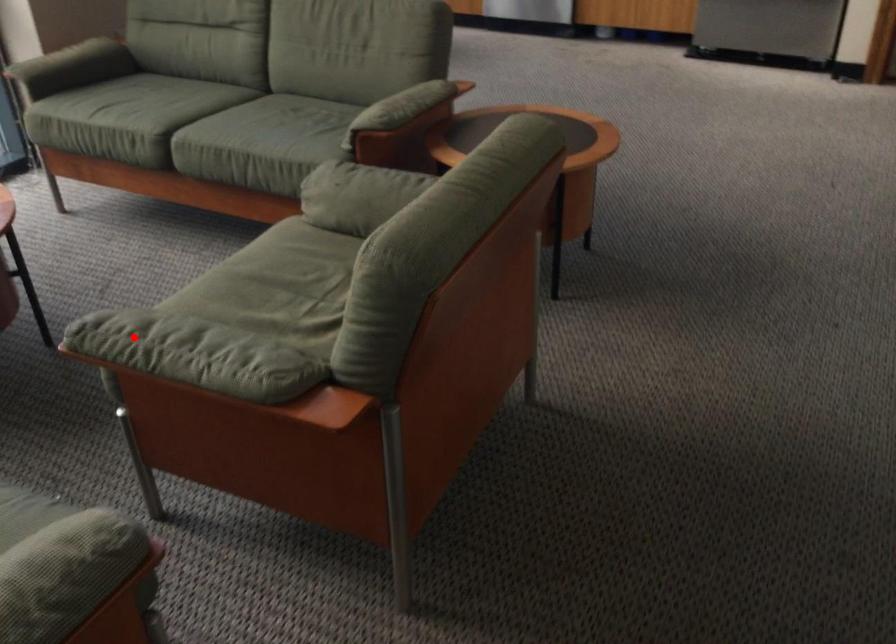
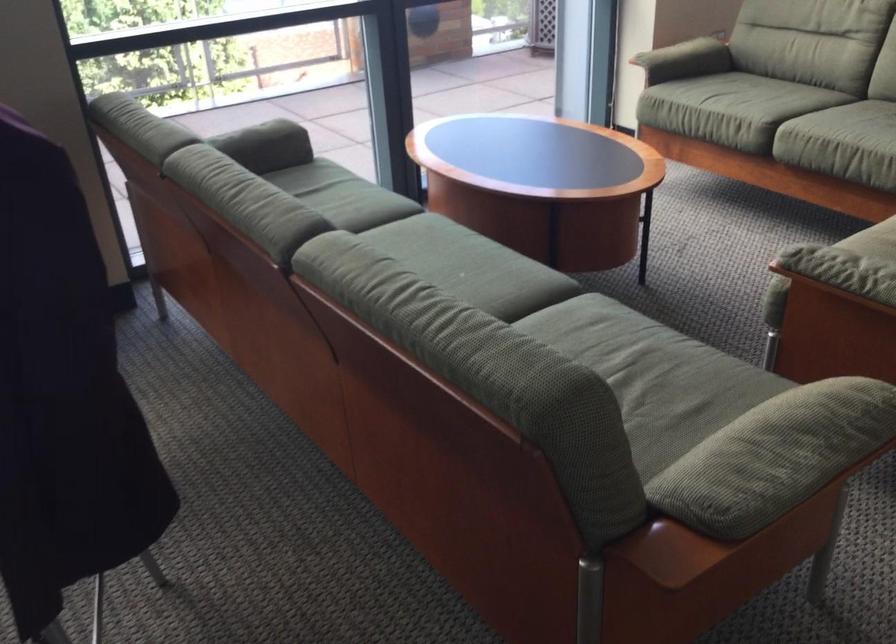
Find the pixel in the second image that matches the highlighted location in the first image.

(834, 263)